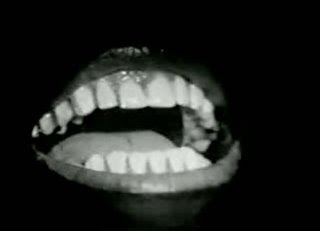
Locate an element on the screen. The image size is (320, 231). corners is located at coordinates (312, 221), (6, 222), (8, 8), (312, 8).